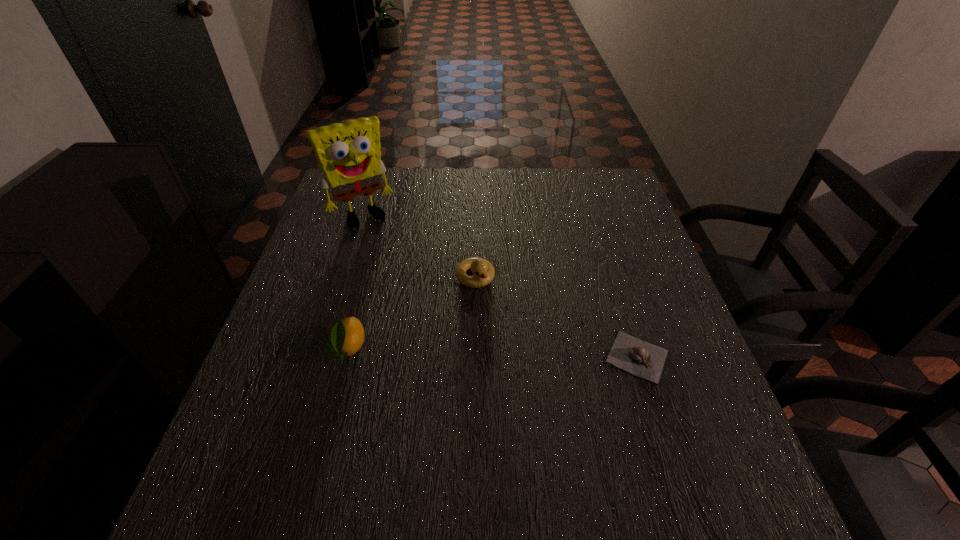
I want to click on vacant space at the far edge of the desktop, so click(x=498, y=208).

Where is `vacant space at the near edge`? The width and height of the screenshot is (960, 540). vacant space at the near edge is located at coordinates (396, 412).

Where is `blank space at the left edge of the desktop`? This screenshot has width=960, height=540. blank space at the left edge of the desktop is located at coordinates (360, 225).

At what (x,y) coordinates should I click in order to perform the action: click on vacant region at the right edge of the desktop. Please return your answer as a coordinate pair (x, y). This screenshot has height=540, width=960. Looking at the image, I should click on (686, 369).

Where is `vacant point located between the third object from left to right and the shortest object`? The width and height of the screenshot is (960, 540). vacant point located between the third object from left to right and the shortest object is located at coordinates (556, 317).

The image size is (960, 540). Find the location of `free spot between the rightmost object and the duckling`. free spot between the rightmost object and the duckling is located at coordinates (556, 317).

Find the location of a particular element. blank region between the rightmost object and the duckling is located at coordinates (556, 317).

Find the location of a particular element. empty space that is in between the rightmost object and the lemon is located at coordinates (492, 353).

I want to click on vacant area that lies between the farthest object and the garlic, so click(x=500, y=286).

Find the location of a particular element. free space that is in between the sponge and the garlic is located at coordinates (500, 286).